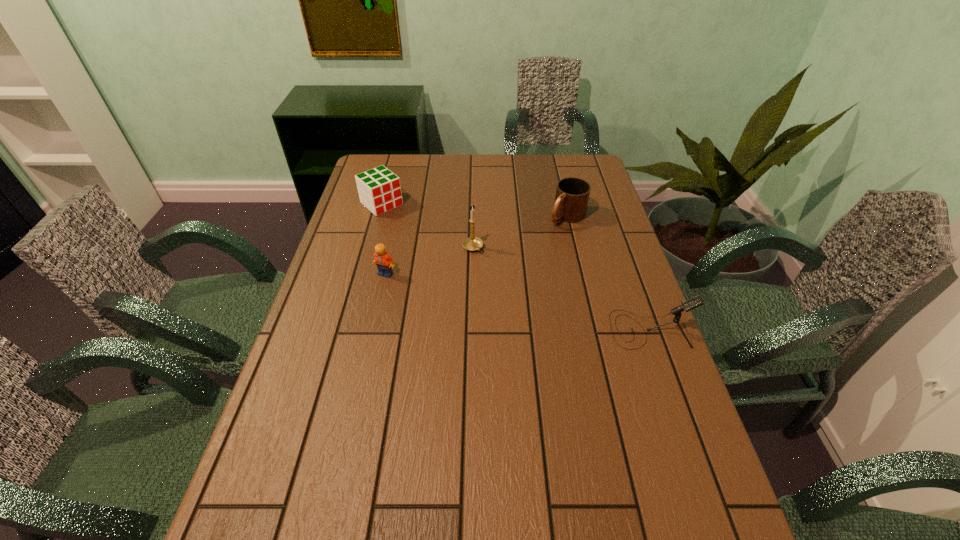
I want to click on free space that satisfies the following two spatial constraints: 1. on the front-facing side of the microphone; 2. on the stand of the fourth farthest object, so click(x=373, y=329).

Locate an element on the screen. The height and width of the screenshot is (540, 960). vacant point that satisfies the following two spatial constraints: 1. on the front side of the mug; 2. on the left side of the cube is located at coordinates (378, 217).

You are a GUI agent. You are given a task and a screenshot of the screen. Output one action in this format:
    pyautogui.click(x=<x>, y=<y>)
    Task: Click on the free point that satisfies the following two spatial constraints: 1. on the front-facing side of the fourth farthest object; 2. on the stand of the microphone
    The height and width of the screenshot is (540, 960).
    Given the screenshot: What is the action you would take?
    pyautogui.click(x=373, y=329)